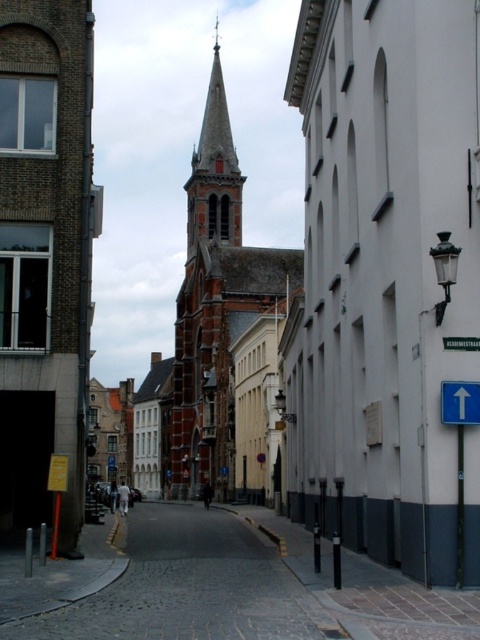
Who is taller, brick church at center or red brick church at center?

With more height is red brick church at center.

Can you confirm if brick church at center is positioned to the right of red brick church at center?

Incorrect, brick church at center is not on the right side of red brick church at center.

Where is `brick church at center`? The width and height of the screenshot is (480, 640). brick church at center is located at coordinates (45, 256).

Can you confirm if smooth white church at center is thinner than reddish-brown brick spire at center?

Yes.

Who is shorter, smooth white church at center or reddish-brown brick spire at center?

smooth white church at center is shorter.

Does point (317, 170) lie in front of point (189, 241)?

Yes.

Where is `smooth white church at center`? smooth white church at center is located at coordinates (388, 282).

Is point (276, 264) in front of point (444, 412)?

No, (276, 264) is behind (444, 412).

Can you confirm if red brick church at center is bigger than blue plastic sign at right?

Yes.

Image resolution: width=480 pixels, height=640 pixels. I want to click on red brick church at center, so click(x=226, y=330).

The image size is (480, 640). Find the location of `red brick church at center`. red brick church at center is located at coordinates (226, 330).